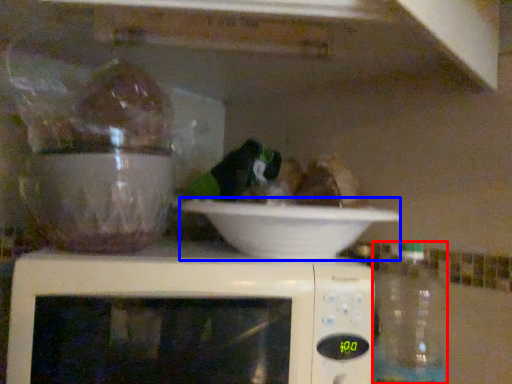
Question: Which point is further to the camera, bottle (highlighted by a red box) or bowl (highlighted by a blue box)?

Choices:
 (A) bottle
 (B) bowl

Answer: (A)